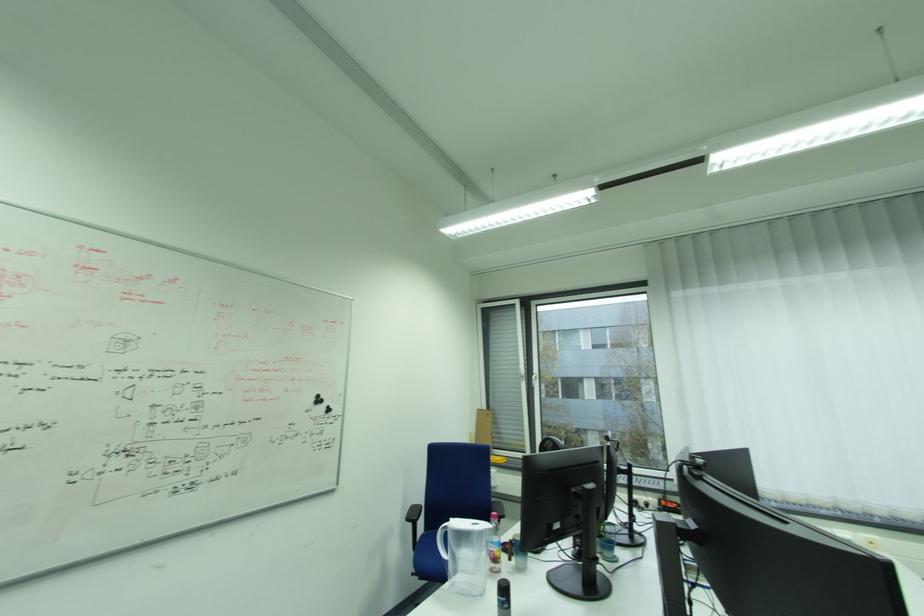
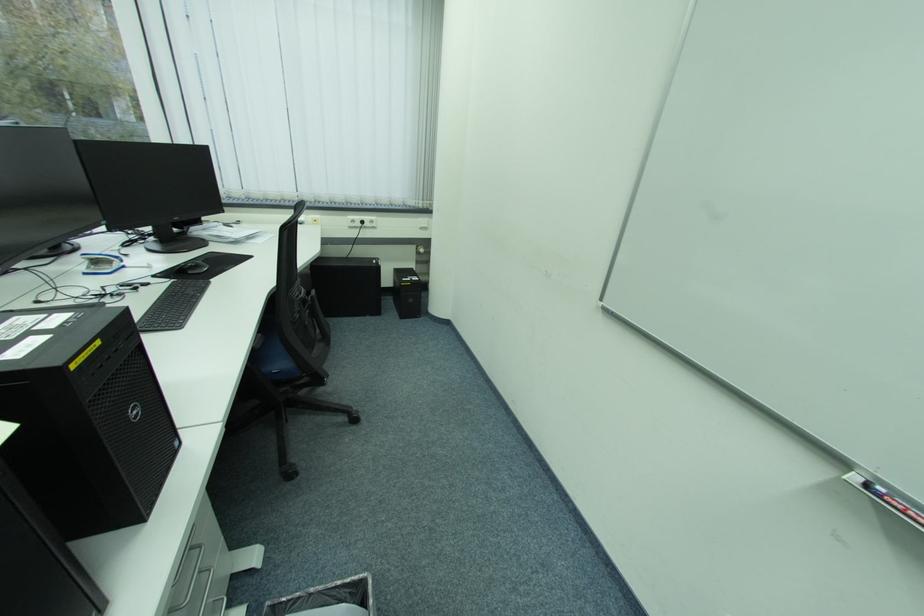
First-person continuous shooting, in which direction is the camera rotating?

The camera rotated toward right-down.